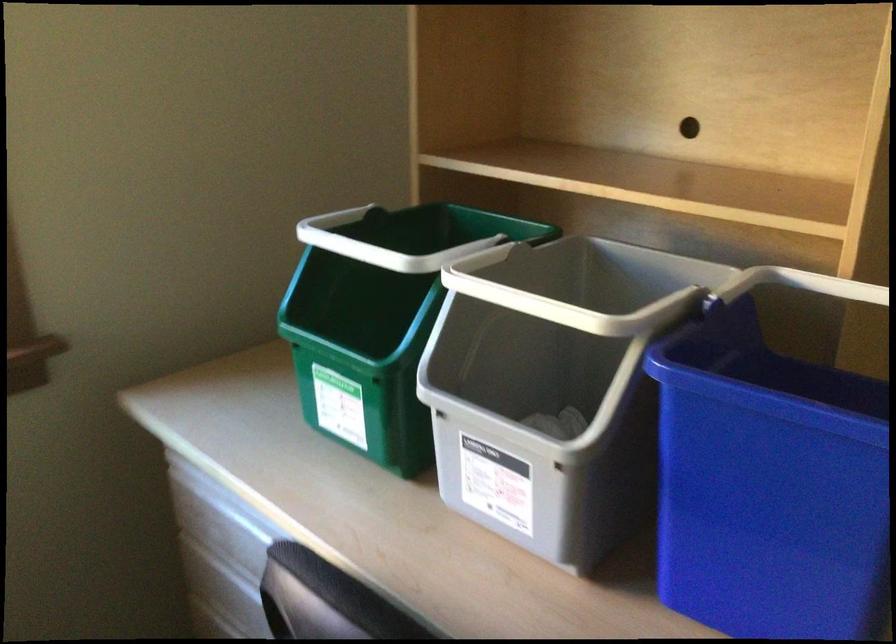
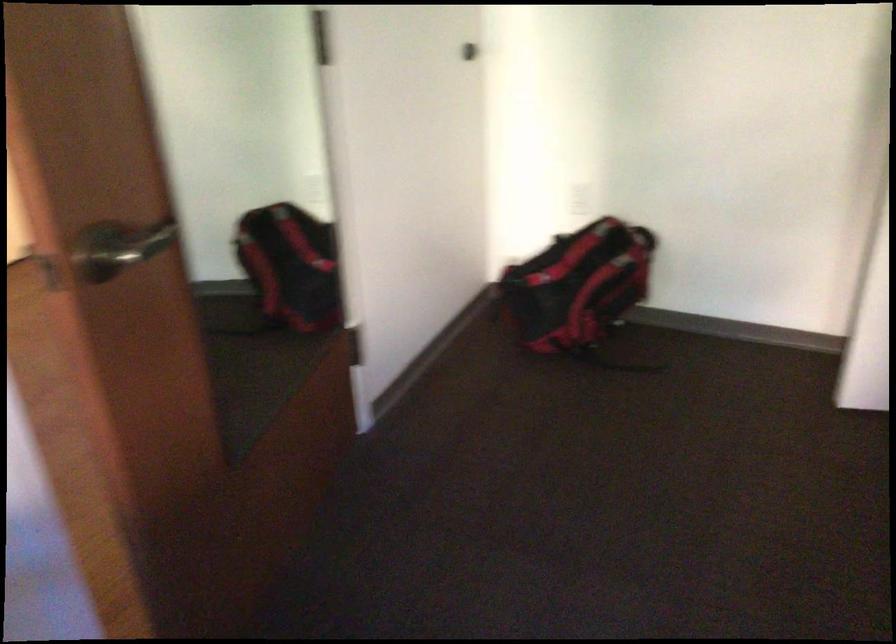
How did the camera likely rotate?

The camera's rotation is toward right-down.